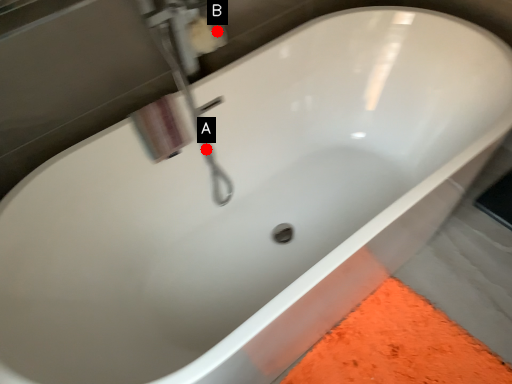
Question: Two points are circled on the image, labeled by A and B beside each circle. Which point appears farthest from the camera in this image?

Choices:
 (A) A is further
 (B) B is further

Answer: (A)